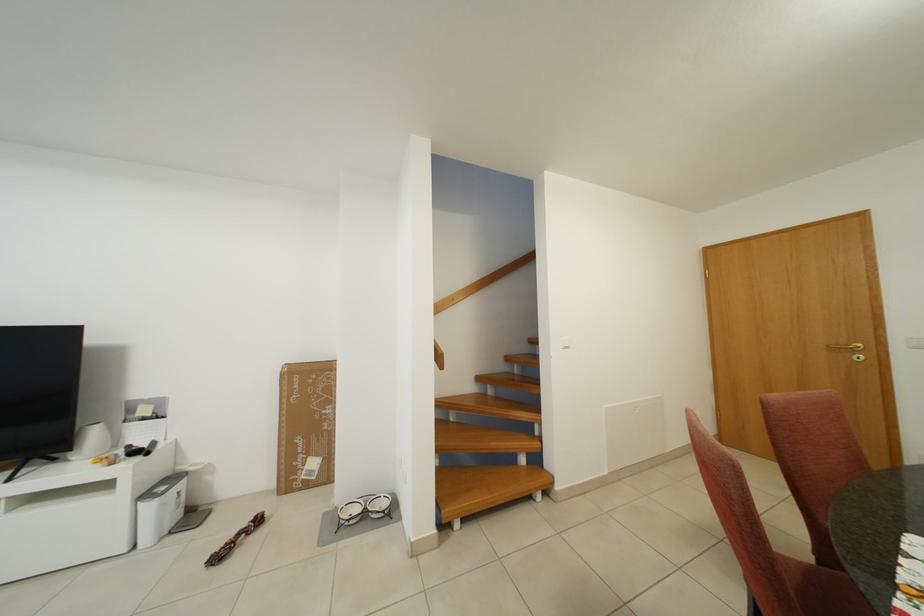
I want to click on white air purifier, so click(x=160, y=509).